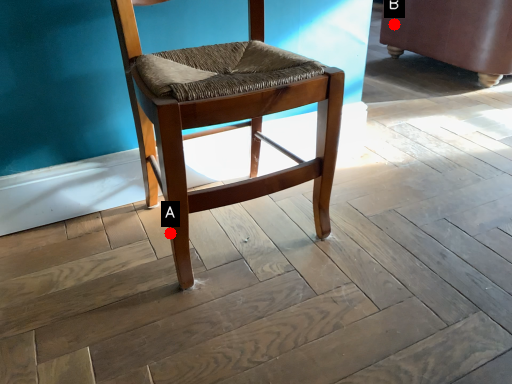
Question: Two points are circled on the image, labeled by A and B beside each circle. Which of the following is the farthest from the observer?

Choices:
 (A) A is further
 (B) B is further

Answer: (B)